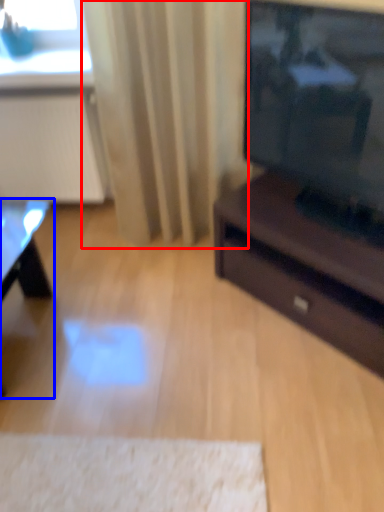
Question: Which object is further to the camera taking this photo, curtain (highlighted by a red box) or table (highlighted by a blue box)?

Choices:
 (A) curtain
 (B) table

Answer: (A)